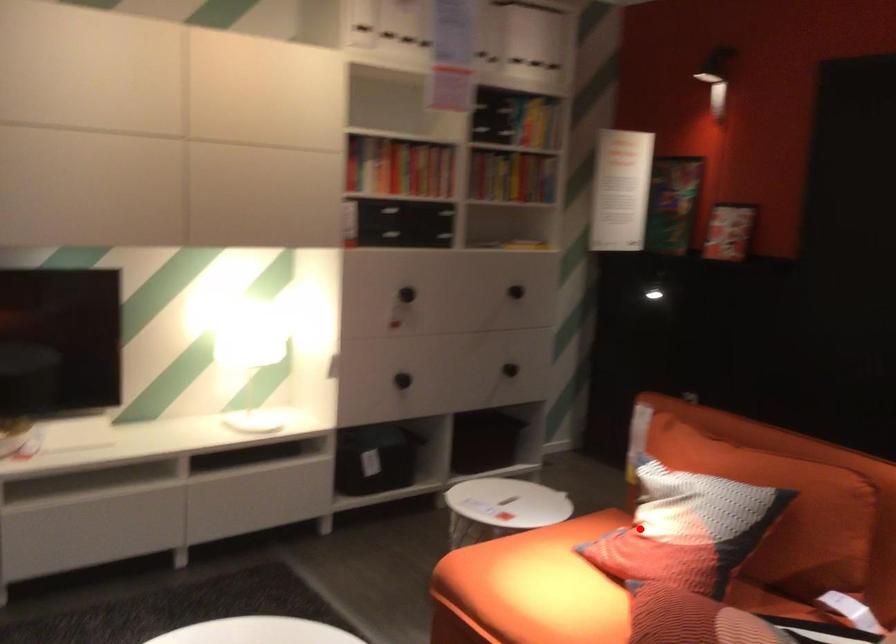
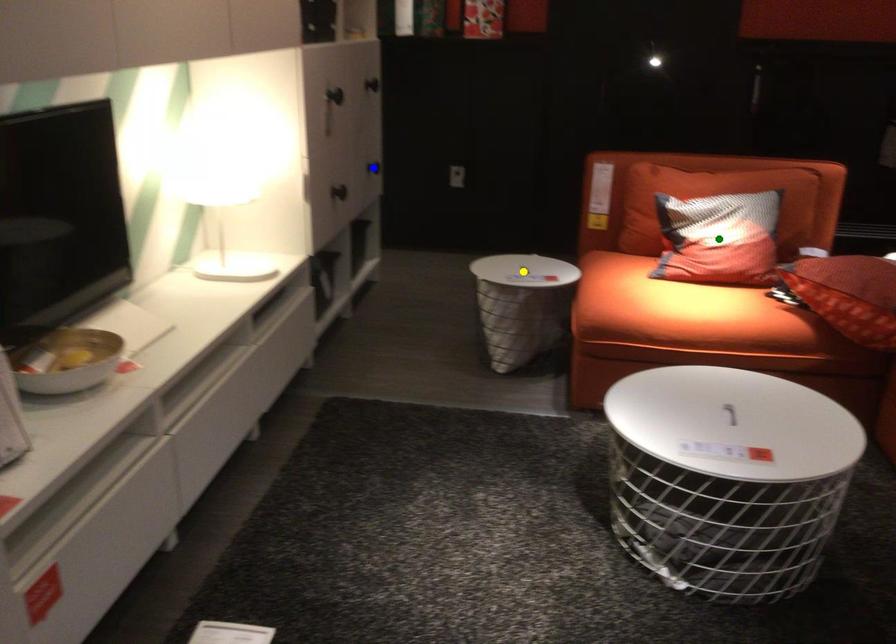
Question: I am providing you with two images of the same scene from different viewpoints. A red point is marked on the first image. You are given multiple points on the second image. Which point in image 2 is actually the same real-world point as the red point in image 1?

Choices:
 (A) green point
 (B) yellow point
 (C) blue point

Answer: (A)